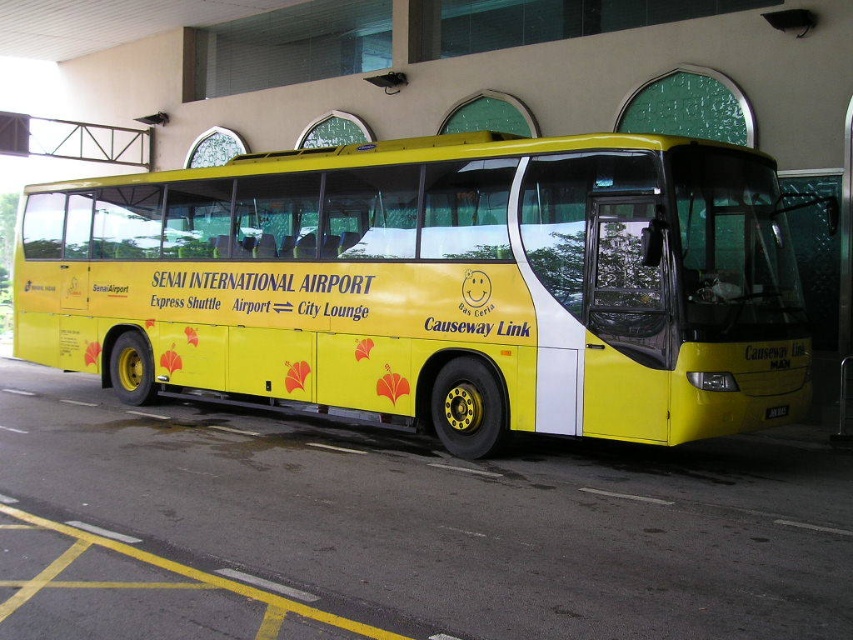
Question: From the image, what is the correct spatial relationship of yellow matte bus at center in relation to yellow asphalt at lower center?

Choices:
 (A) left
 (B) right

Answer: (B)

Question: Is yellow matte bus at center below yellow asphalt at lower center?

Choices:
 (A) no
 (B) yes

Answer: (A)

Question: Which of the following is the closest to the observer?

Choices:
 (A) yellow asphalt at lower center
 (B) yellow matte bus at center

Answer: (A)

Question: Is yellow matte bus at center further to camera compared to yellow asphalt at lower center?

Choices:
 (A) no
 (B) yes

Answer: (B)

Question: Which point appears closest to the camera in this image?

Choices:
 (A) (463, 540)
 (B) (462, 243)

Answer: (A)